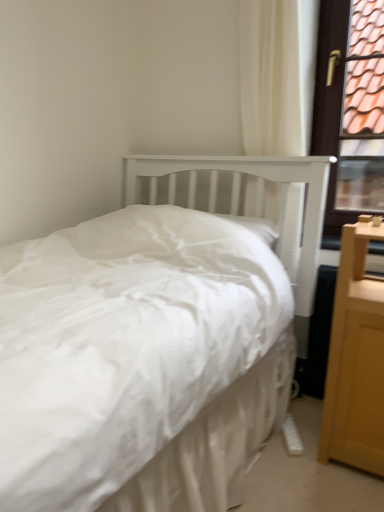
Question: From the image's perspective, is light wood nightstand at right positioned above or below brown wooden window frame at upper right?

Choices:
 (A) above
 (B) below

Answer: (B)

Question: Considering the positions of light wood nightstand at right and brown wooden window frame at upper right in the image, is light wood nightstand at right taller or shorter than brown wooden window frame at upper right?

Choices:
 (A) tall
 (B) short

Answer: (B)

Question: From a real-world perspective, is light wood nightstand at right positioned above or below brown wooden window frame at upper right?

Choices:
 (A) above
 (B) below

Answer: (B)

Question: Looking at their shapes, would you say brown wooden window frame at upper right is wider or thinner than light wood nightstand at right?

Choices:
 (A) wide
 (B) thin

Answer: (B)

Question: From a real-world perspective, is brown wooden window frame at upper right above or below light wood nightstand at right?

Choices:
 (A) below
 (B) above

Answer: (B)

Question: Is brown wooden window frame at upper right spatially inside light wood nightstand at right, or outside of it?

Choices:
 (A) inside
 (B) outside

Answer: (B)

Question: In the image, is brown wooden window frame at upper right positioned in front of or behind light wood nightstand at right?

Choices:
 (A) behind
 (B) front

Answer: (A)